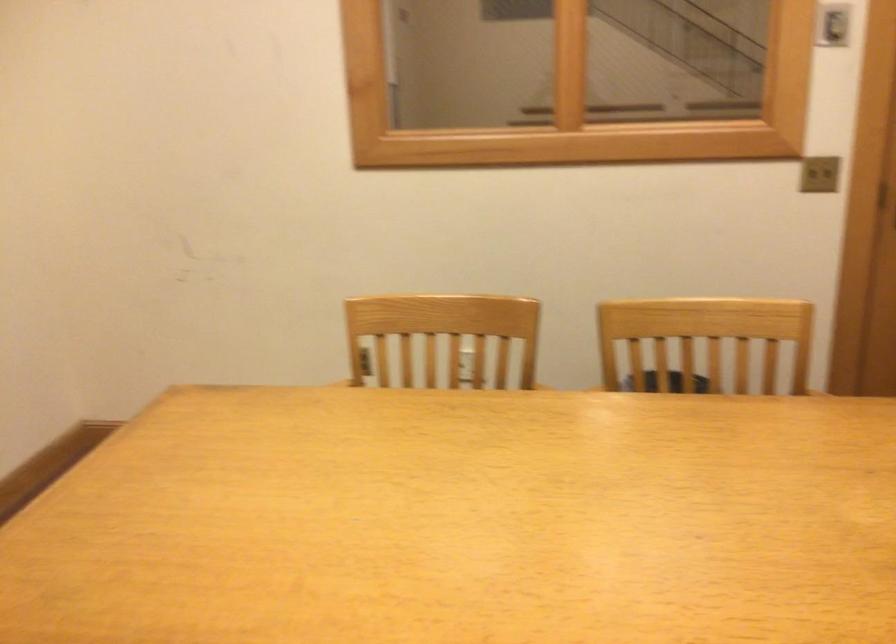
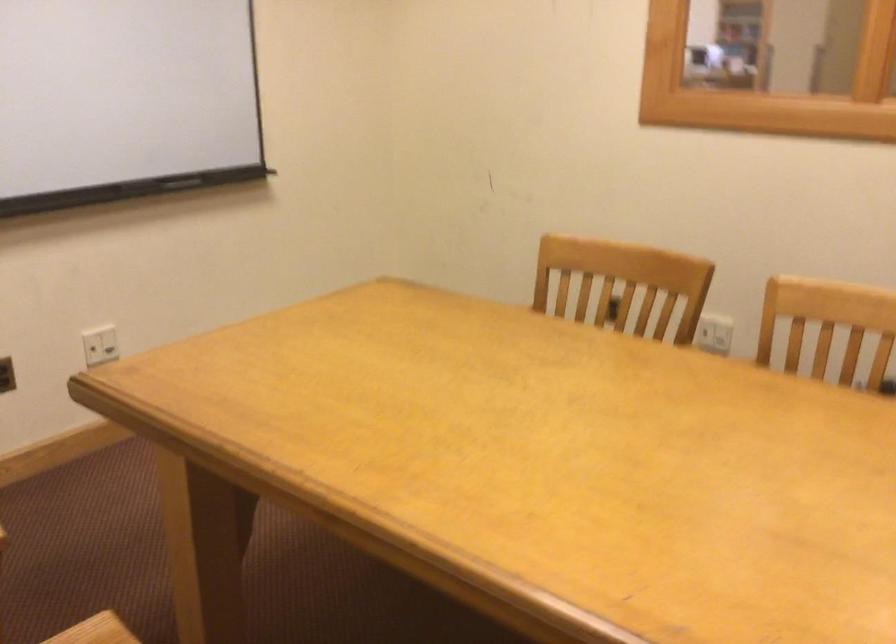
Question: How did the camera likely rotate?

Choices:
 (A) Left
 (B) Right
 (C) Up
 (D) Down

Answer: (A)